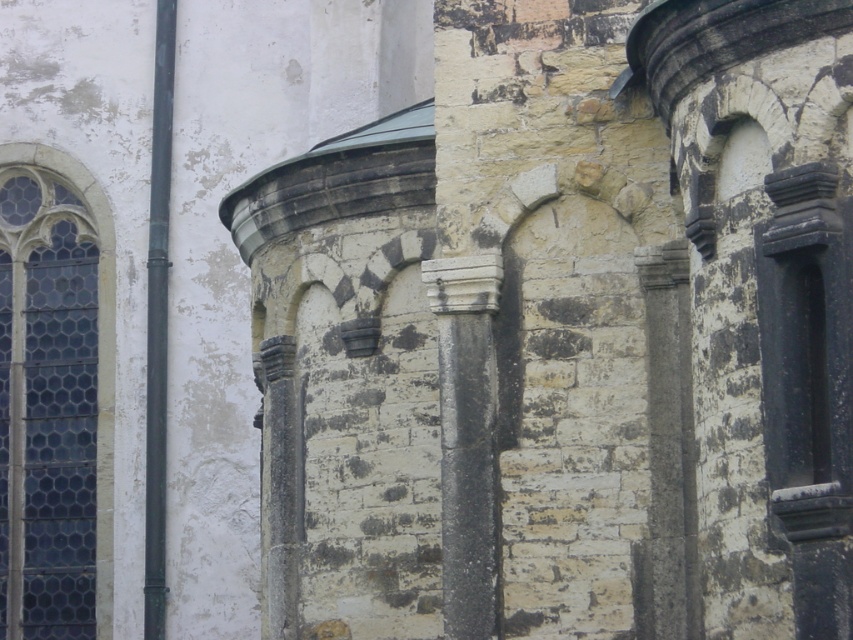
Question: Observing the image, what is the correct spatial positioning of dark blue glass window at left in reference to white stone column at center?

Choices:
 (A) below
 (B) above

Answer: (A)

Question: Which point is closer to the camera?

Choices:
 (A) white stone column at center
 (B) dark blue glass window at left

Answer: (A)

Question: Does dark blue glass window at left appear over white stone column at center?

Choices:
 (A) no
 (B) yes

Answer: (A)

Question: Among these points, which one is farthest from the camera?

Choices:
 (A) (445, 323)
 (B) (50, 524)

Answer: (B)

Question: Does dark blue glass window at left have a lesser width compared to white stone column at center?

Choices:
 (A) yes
 (B) no

Answer: (B)